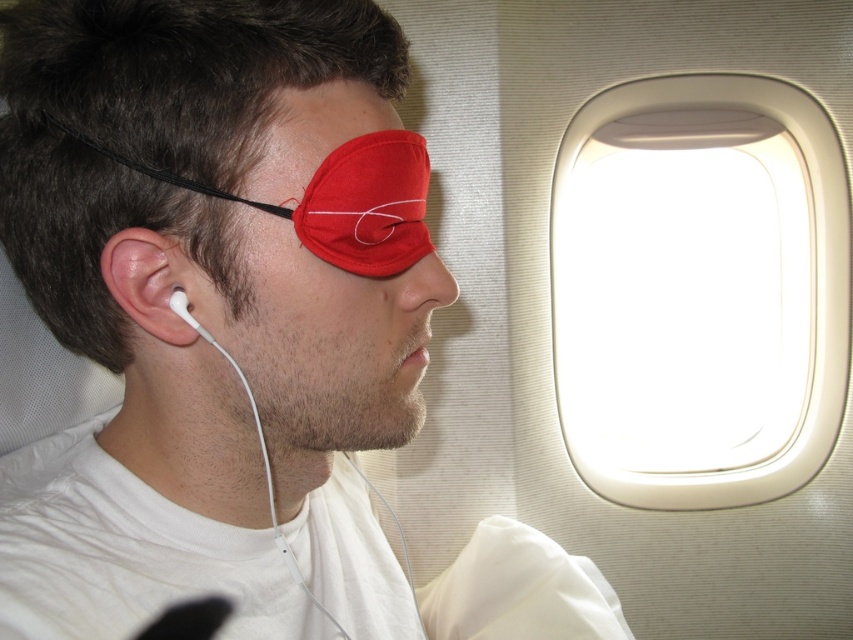
You are a flight attendant checking the cabin. You notice the white plastic airplane window at upper right and the red fabric eye mask at upper left. Which object is closer to you as you walk down the aisle?

The white plastic airplane window at upper right is further to the viewer than the red fabric eye mask at upper left, so the red fabric eye mask at upper left is closer to you.

You are a flight attendant checking the airplane cabin. You notice two points marked in the cabin. The first point is at coordinates point (338, 237) and the second is at point (173, 294). Which point is closer to the airplane window?

Point (338, 237) is in front of point (173, 294), so it is closer to the airplane window.